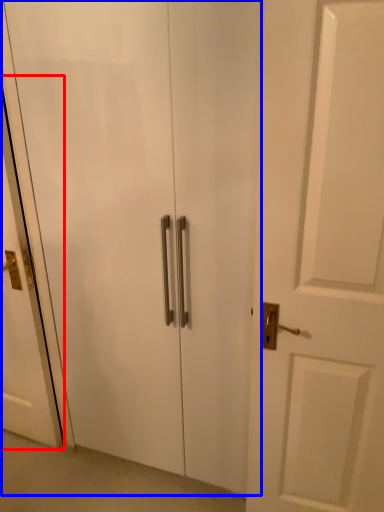
Question: Which object is closer to the camera taking this photo, screen door (highlighted by a red box) or elevator (highlighted by a blue box)?

Choices:
 (A) screen door
 (B) elevator

Answer: (B)